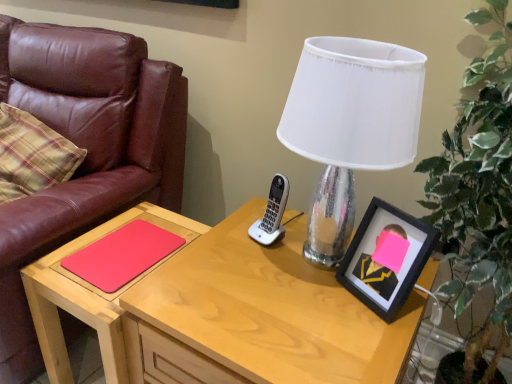
At what (x,y) coordinates should I click in order to perform the action: click on blank space situated above rubberized matte red notepad at lower left (from a real-world perspective). Please return your answer as a coordinate pair (x, y). This screenshot has width=512, height=384. Looking at the image, I should click on tap(129, 245).